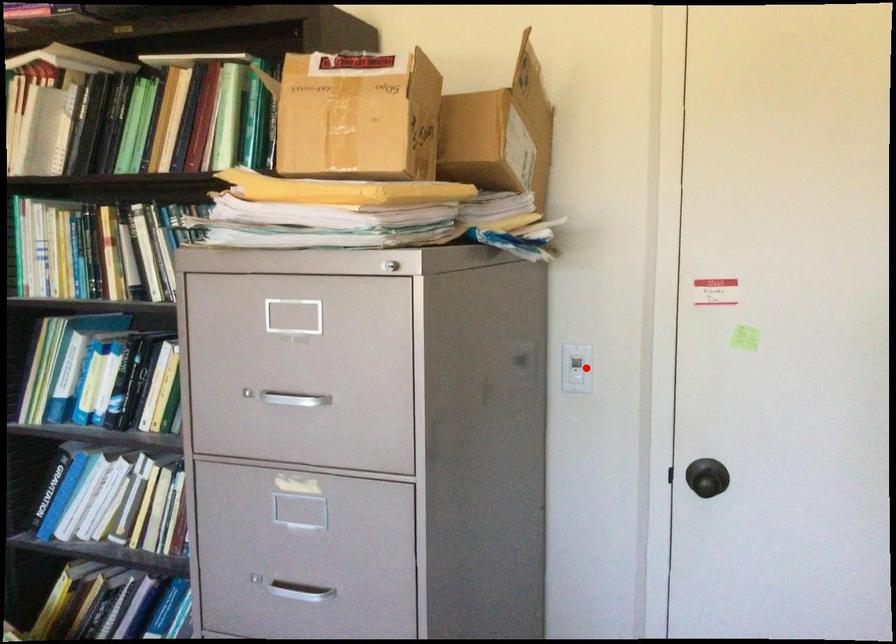
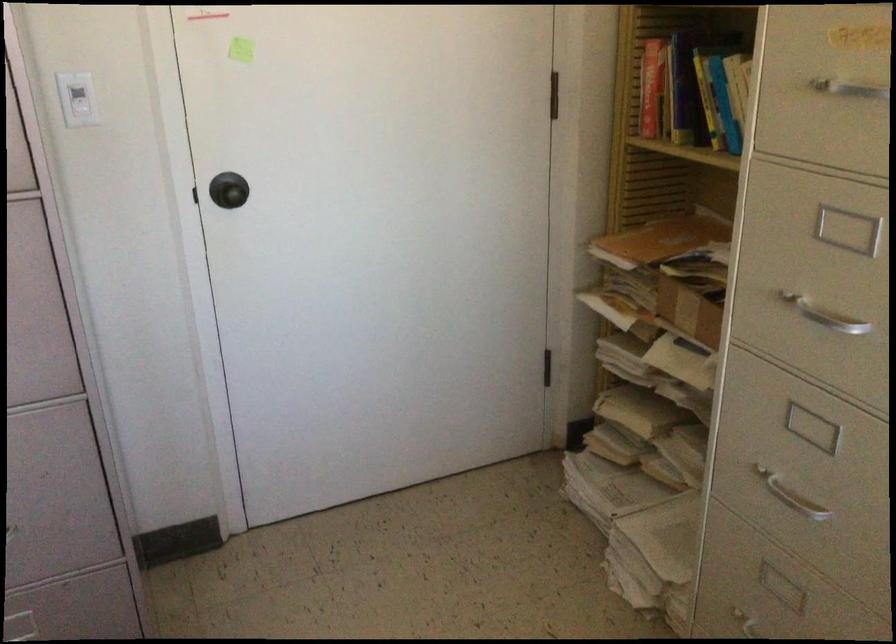
Question: A red point is marked in image1. In image2, is the corresponding 3D point closer to the camera or farther? Reply with the corresponding letter.

Choices:
 (A) The corresponding 3D point is closer.
 (B) The corresponding 3D point is farther.

Answer: (A)